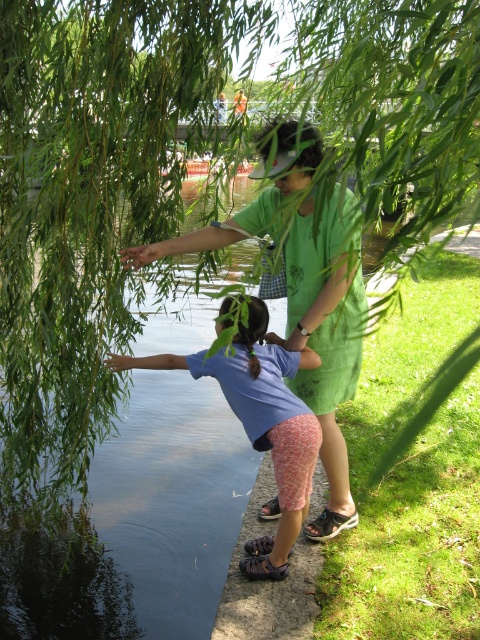
You are a photographer trying to capture a photo of both the green cotton shirt at center and the blue cotton shirt at lower left. Which shirt should you focus on first to ensure both are in the frame?

Since the green cotton shirt at center is in front of the blue cotton shirt at lower left, you should focus on the green cotton shirt at center first to ensure both are in the frame.

You are standing in the scene and want to hand a drink to both the green cotton shirt at center and the blue cotton shirt at lower left. Which person should you approach first to ensure you can reach them without moving from your current position?

You should approach the green cotton shirt at center first because they are located above the blue cotton shirt at lower left, making them more accessible from your current position.